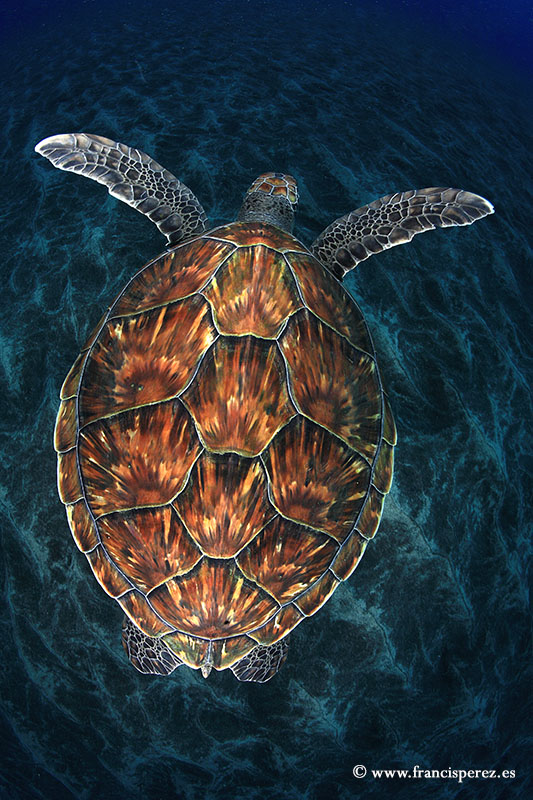
Locate an element on the screen. corner is located at coordinates (484, 36).